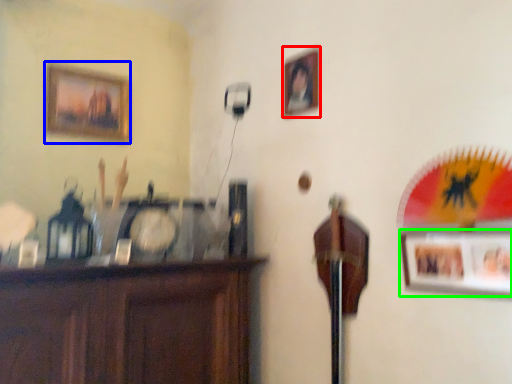
Question: Which is nearer to the picture frame (highlighted by a red box)? picture frame (highlighted by a blue box) or picture frame (highlighted by a green box).

Choices:
 (A) picture frame
 (B) picture frame

Answer: (B)